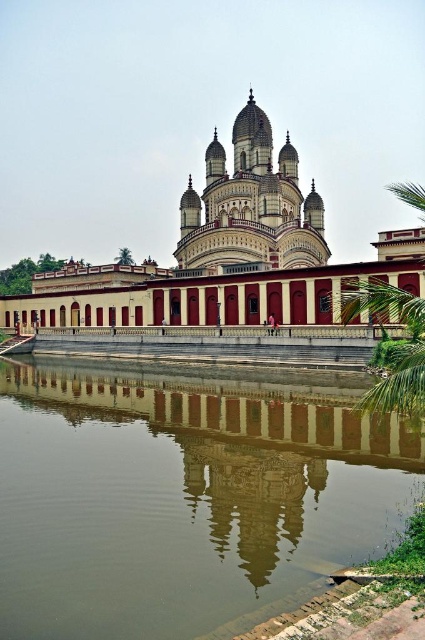
You are a tourist standing in front of the temple and want to take a photo that includes both the brown concrete water at center and the matte red building at center. Based on their positions, which one should you focus on first to ensure both are in the frame?

The brown concrete water at center is in front of the matte red building at center, so you should focus on the brown concrete water at center first to ensure both are in the frame.

You are standing in front of the temple and notice a specific point marked at coordinates (226, 253). Based on the scene description, what architectural feature does this point most likely represent?

The point at coordinates (226, 253) corresponds to the matte red building at center, which is the central part of the temple structure with its ornate domes and spires.